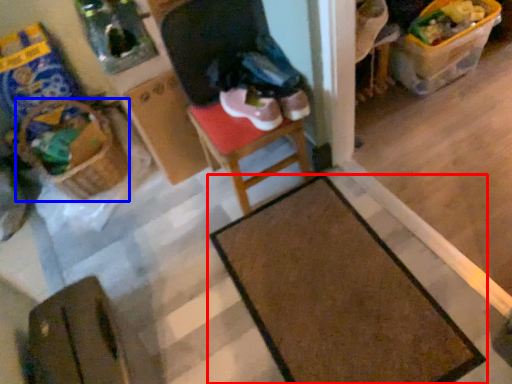
Question: Which point is closer to the camera, table (highlighted by a red box) or basket (highlighted by a blue box)?

Choices:
 (A) table
 (B) basket

Answer: (A)